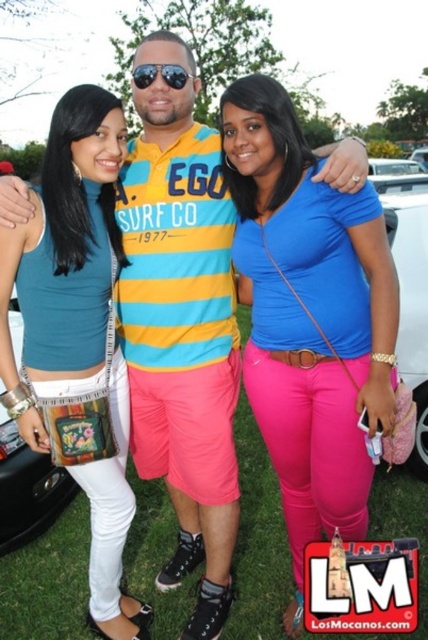
You are a photographer trying to focus on the blue matte shirt at center and sunglasses at center. Which object should you zoom in on to ensure it fills the frame better?

The blue matte shirt at center is bigger than sunglasses at center, so you should zoom in on the blue matte shirt at center to ensure it fills the frame better.

You are a photographer trying to focus on the teal fabric tank top at center and the sunglasses at center. Which object should you adjust your camera focus on first if you want to capture both clearly in the same shot?

The teal fabric tank top at center is in front of the sunglasses at center, so you should focus on the teal fabric tank top at center first to ensure both are in focus.

You are a photographer trying to adjust the lighting for a group photo. You notice two clothing items at the center of the image, the blue matte shirt at center and the teal fabric tank top at center. Which clothing item would cast a bigger shadow if the light source is directly above them?

The blue matte shirt at center has a larger size compared to the teal fabric tank top at center, so it would cast a bigger shadow.